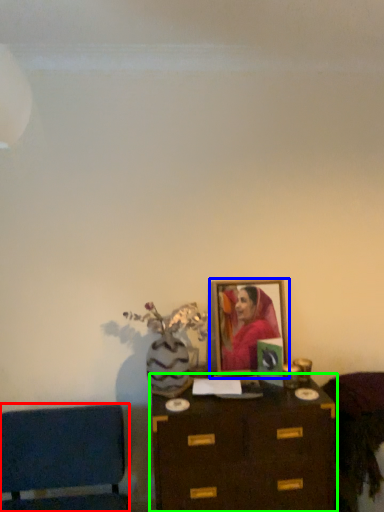
Question: Estimate the real-world distances between objects in this image. Which object is closer to furniture (highlighted by a red box), picture frame (highlighted by a blue box) or table (highlighted by a green box)?

Choices:
 (A) picture frame
 (B) table

Answer: (B)